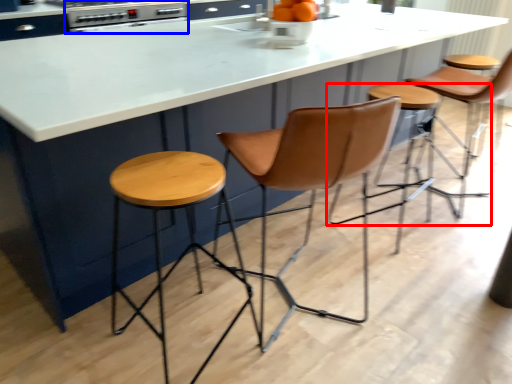
Question: Which object appears closest to the camera in this image, stool (highlighted by a red box) or appliance (highlighted by a blue box)?

Choices:
 (A) stool
 (B) appliance

Answer: (A)